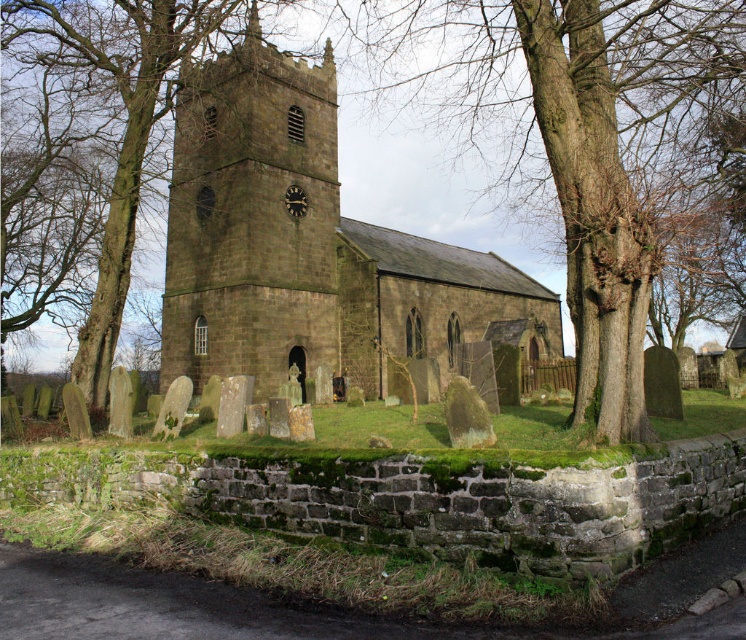
Does dark brown stone church tower at center appear under brown textured tree at left?

Yes, dark brown stone church tower at center is below brown textured tree at left.

Is dark brown stone church tower at center closer to camera compared to brown textured tree at left?

No, it is not.

Which is behind, point (222, 317) or point (51, 24)?

Point (222, 317)

Identify the location of dark brown stone church tower at center. This screenshot has width=746, height=640. (251, 218).

Describe the element at coordinates (577, 140) in the screenshot. I see `brown rough tree at center` at that location.

Does brown rough tree at center have a smaller size compared to dark brown stone church tower at center?

Actually, brown rough tree at center might be larger than dark brown stone church tower at center.

Locate an element on the screen. brown rough tree at center is located at coordinates (577, 140).

Who is lower down, brown rough tree at center or brown textured tree at left?

brown textured tree at left is lower down.

The height and width of the screenshot is (640, 746). What do you see at coordinates (577, 140) in the screenshot?
I see `brown rough tree at center` at bounding box center [577, 140].

Where is `brown rough tree at center`? The image size is (746, 640). brown rough tree at center is located at coordinates (577, 140).